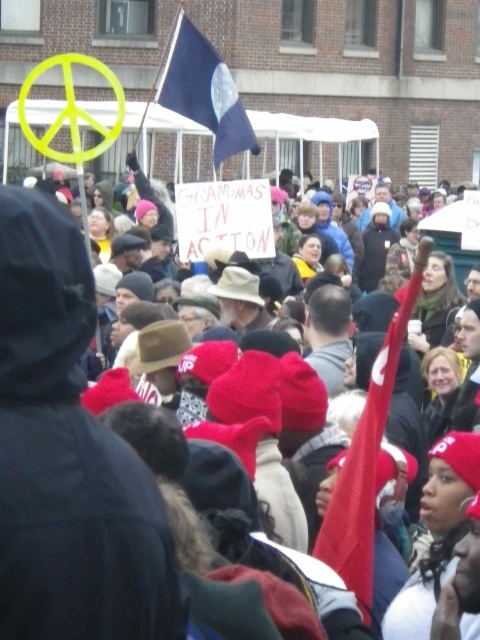
Does red fabric flag at center appear on the right side of blue fabric flag at upper center?

Correct, you'll find red fabric flag at center to the right of blue fabric flag at upper center.

Between point (354, 492) and point (205, 125), which one is positioned behind?

Point (205, 125)

Between point (371, 538) and point (192, 90), which one is positioned behind?

Point (192, 90)

Locate an element on the screen. Image resolution: width=480 pixels, height=640 pixels. red fabric flag at center is located at coordinates (367, 461).